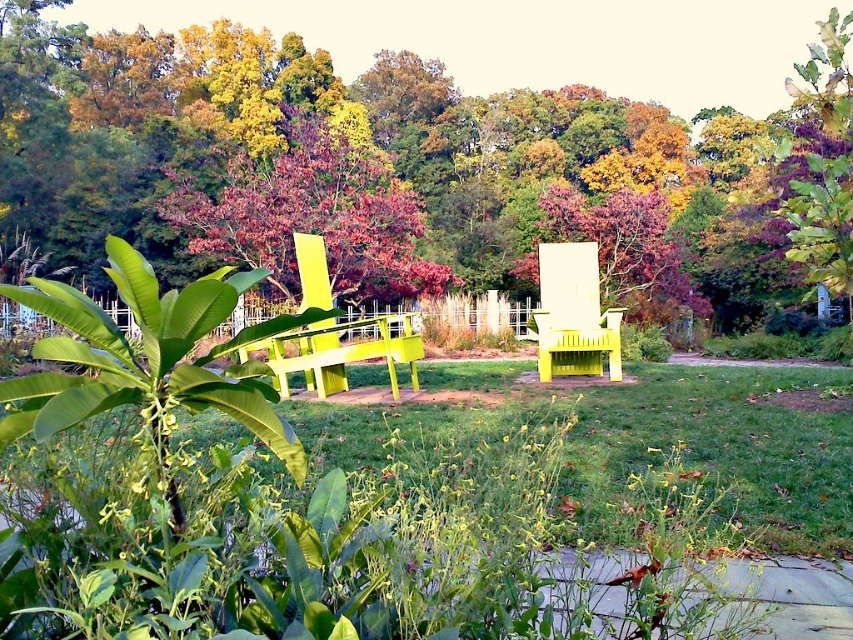
You are planning to set up a small garden in your backyard and want to place a decorative statue between the green grass at center and the yellow matte chair at center. Based on their sizes, which object should the statue be placed closer to?

The green grass at center is smaller than the yellow matte chair at center, so the statue should be placed closer to the yellow matte chair at center to maintain balance in the arrangement.

You are standing in the outdoor area and want to sit down. Which object, the green grass at center or the yellow matte chair at center, is closer to you?

The green grass at center is closer to the viewer than the yellow matte chair at center, so the green grass at center would be closer to you.

You are standing in the autumn outdoor scene and want to sit down. Which object, the smooth yellow bench at center or the yellow matte chair at center, is closer to you?

The smooth yellow bench at center is closer to you than the yellow matte chair at center.